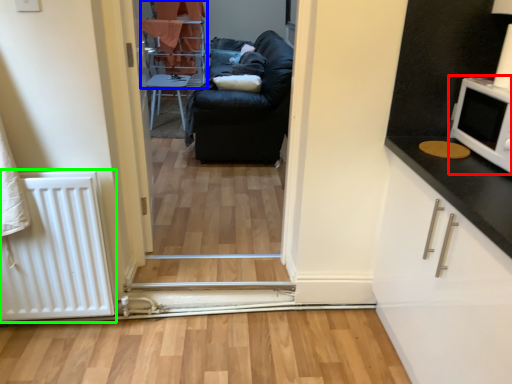
Question: Considering the real-world distances, which object is closest to appliance (highlighted by a red box)? bunk bed (highlighted by a blue box) or radiator (highlighted by a green box).

Choices:
 (A) bunk bed
 (B) radiator

Answer: (B)